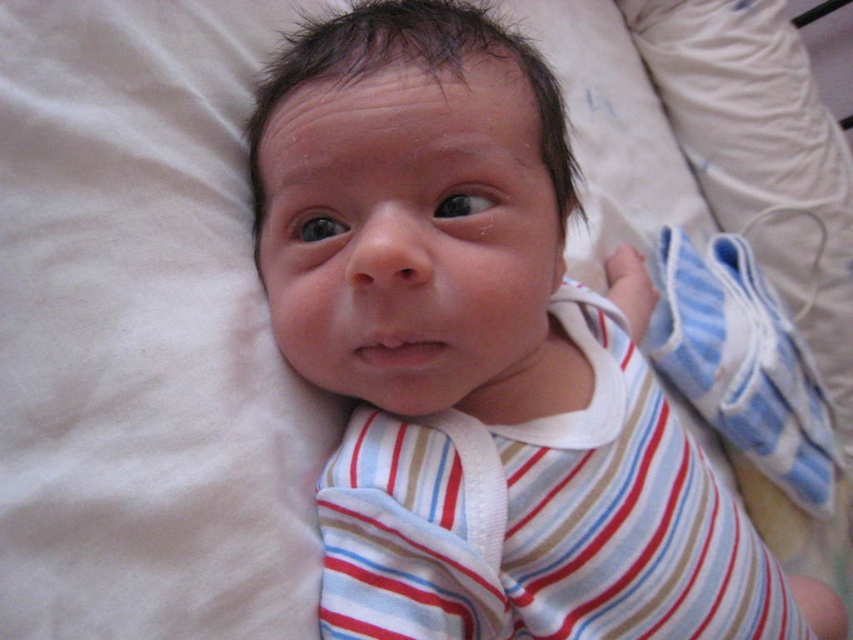
Question: Which object is closer to the camera taking this photo?

Choices:
 (A) striped cotton shirt at center
 (B) striped fabric baby at center

Answer: (B)

Question: Can you confirm if striped fabric baby at center is positioned below striped cotton shirt at center?

Choices:
 (A) no
 (B) yes

Answer: (A)

Question: Which point is closer to the camera?

Choices:
 (A) striped fabric baby at center
 (B) striped cotton shirt at center

Answer: (A)

Question: Is striped fabric baby at center to the right of striped cotton shirt at center from the viewer's perspective?

Choices:
 (A) yes
 (B) no

Answer: (A)

Question: Does striped fabric baby at center appear on the right side of striped cotton shirt at center?

Choices:
 (A) yes
 (B) no

Answer: (A)

Question: Which object is closer to the camera taking this photo?

Choices:
 (A) striped cotton shirt at center
 (B) striped fabric baby at center

Answer: (B)